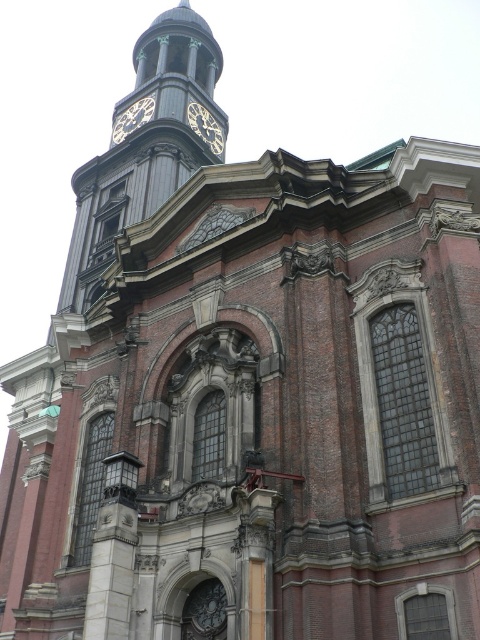
Which of these two, gold metallic clock at upper left or gold metallic clock at upper center, stands taller?

gold metallic clock at upper center

Does point (151, 93) lie in front of point (212, 150)?

No, (151, 93) is further to viewer.

Where is `gold metallic clock at upper left`? The image size is (480, 640). gold metallic clock at upper left is located at coordinates (132, 118).

Between polished brass clock tower at upper center and gold metallic clock at upper center, which one is positioned lower?

gold metallic clock at upper center is below.

Where is `polished brass clock tower at upper center`? polished brass clock tower at upper center is located at coordinates (144, 148).

Who is positioned more to the left, polished brass clock tower at upper center or gold metallic clock at upper left?

polished brass clock tower at upper center is more to the left.

Which is above, polished brass clock tower at upper center or gold metallic clock at upper left?

polished brass clock tower at upper center is higher up.

Which is in front, point (160, 138) or point (143, 122)?

Positioned in front is point (160, 138).

Where is `polished brass clock tower at upper center`? The width and height of the screenshot is (480, 640). polished brass clock tower at upper center is located at coordinates (144, 148).